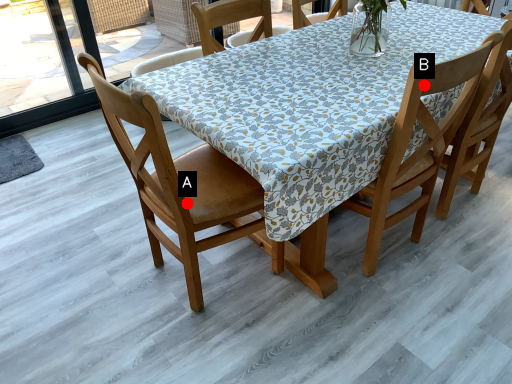
Question: Two points are circled on the image, labeled by A and B beside each circle. Which point appears farthest from the camera in this image?

Choices:
 (A) A is further
 (B) B is further

Answer: (A)